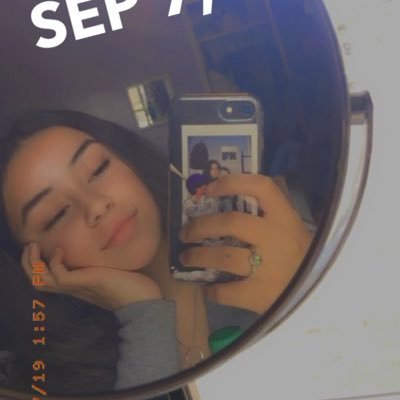
This screenshot has width=400, height=400. I want to click on white wall, so click(x=314, y=376).